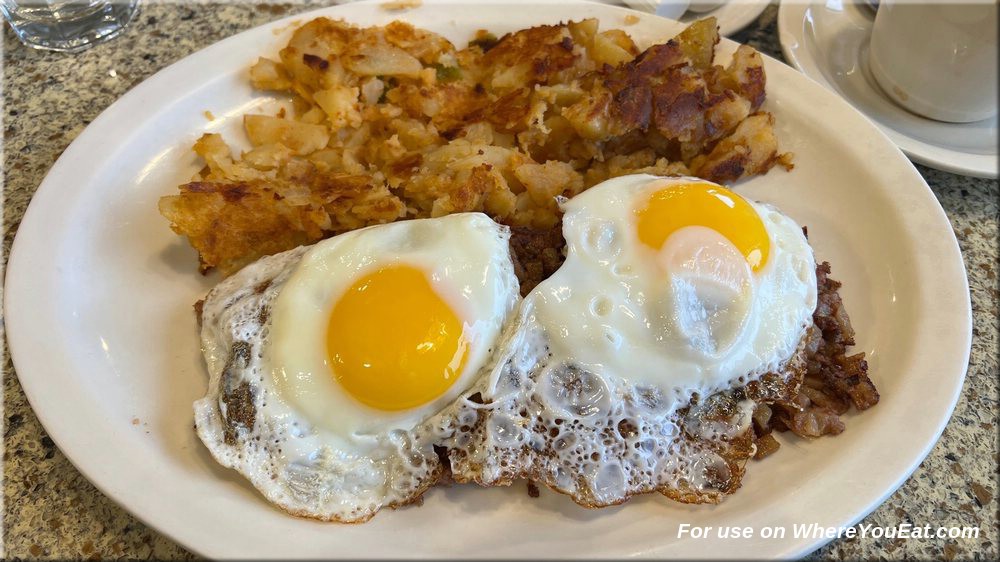
Locate an element on the screen. The height and width of the screenshot is (562, 1000). saucer is located at coordinates (732, 24).